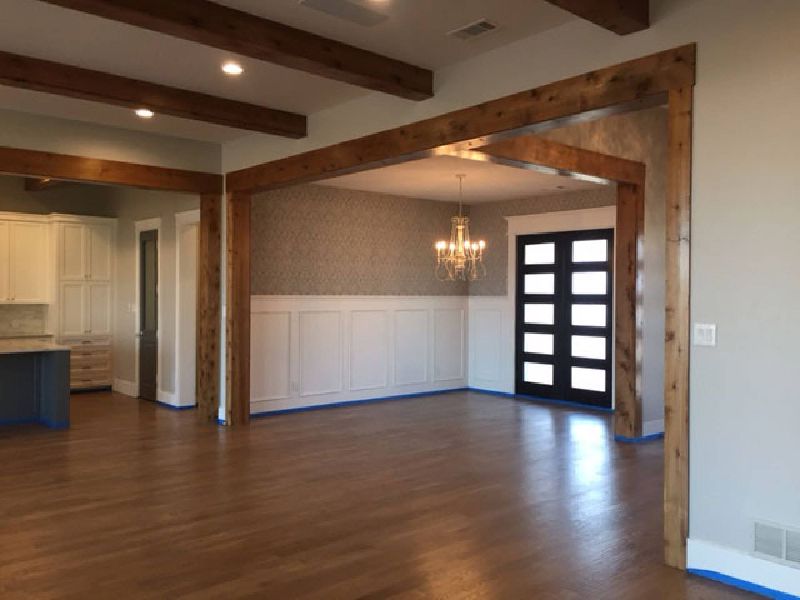
Locate an element on the screen. This screenshot has height=600, width=800. chandelier is located at coordinates (458, 238).